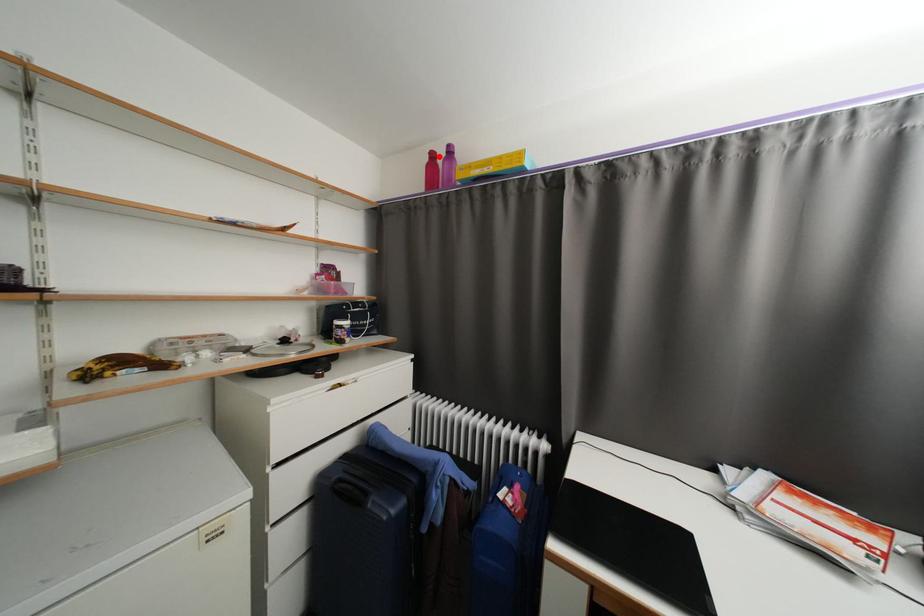
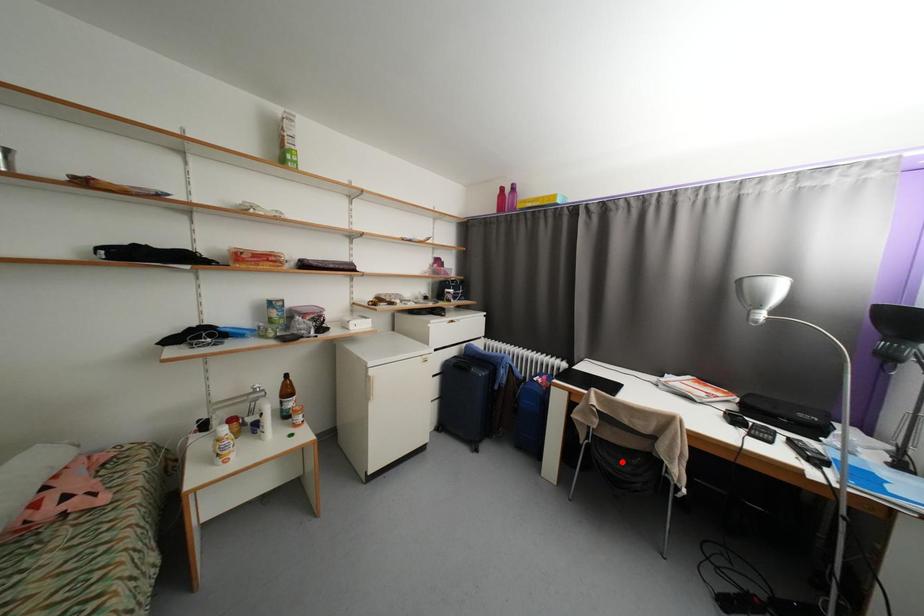
I am providing you with two images of the same scene from different viewpoints. A red point is marked on the first image and another point is marked on the second image. Is the marked point in image1 the same physical position as the marked point in image2?

No